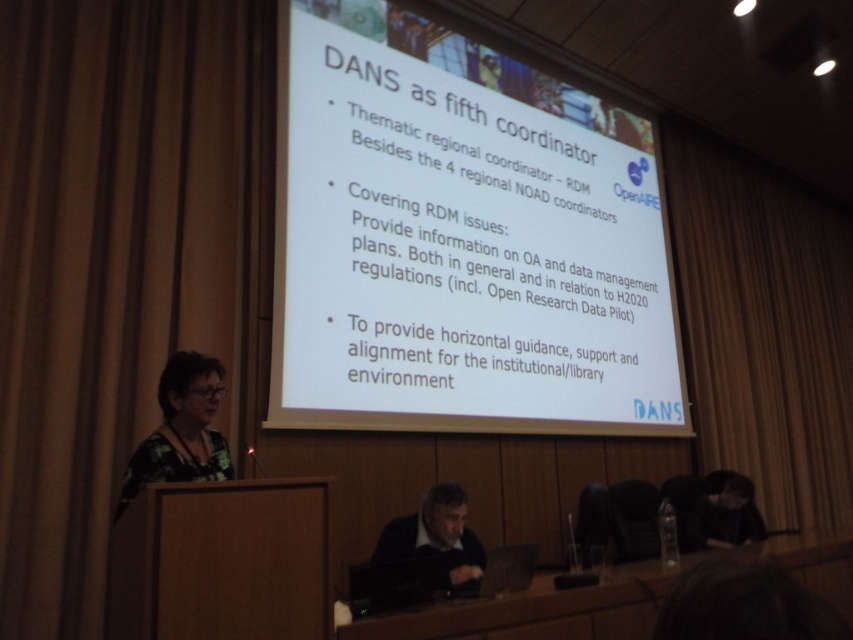
You are an attendee at the presentation and need to refer to the white paper at center and the black fabric at lower right. Which object is closer to you?

The white paper at center is closer to you because it is in front of the black fabric at lower right.

You are an event organizer preparing for a presentation in the conference room. You notice the printed floral blouse at left and the black fabric at lower right. Which object is positioned higher in the image?

The printed floral blouse at left is much taller as black fabric at lower right, so the printed floral blouse at left is positioned higher in the image.

You are organizing a presentation in the conference room and need to decide which fabric to use to cover the windows. The brown fabric curtain at left and the black fabric at lower right are available. Which fabric has a bigger size?

The brown fabric curtain at left is larger in size than the black fabric at lower right, so the brown fabric curtain at left has a bigger size.